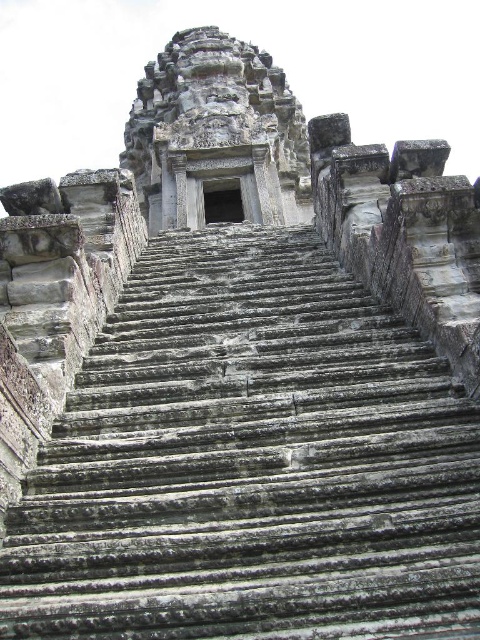
Question: Does gray stone stairs at center come in front of gray stone temple at center?

Choices:
 (A) no
 (B) yes

Answer: (B)

Question: Which point is closer to the camera taking this photo?

Choices:
 (A) (190, 128)
 (B) (452, 417)

Answer: (B)

Question: Which point is farther to the camera?

Choices:
 (A) gray stone temple at center
 (B) gray stone stairs at center

Answer: (A)

Question: From the image, what is the correct spatial relationship of gray stone stairs at center in relation to gray stone temple at center?

Choices:
 (A) right
 (B) left

Answer: (A)

Question: Does gray stone stairs at center appear on the right side of gray stone temple at center?

Choices:
 (A) yes
 (B) no

Answer: (A)

Question: Among these points, which one is nearest to the camera?

Choices:
 (A) (238, 509)
 (B) (235, 68)

Answer: (A)